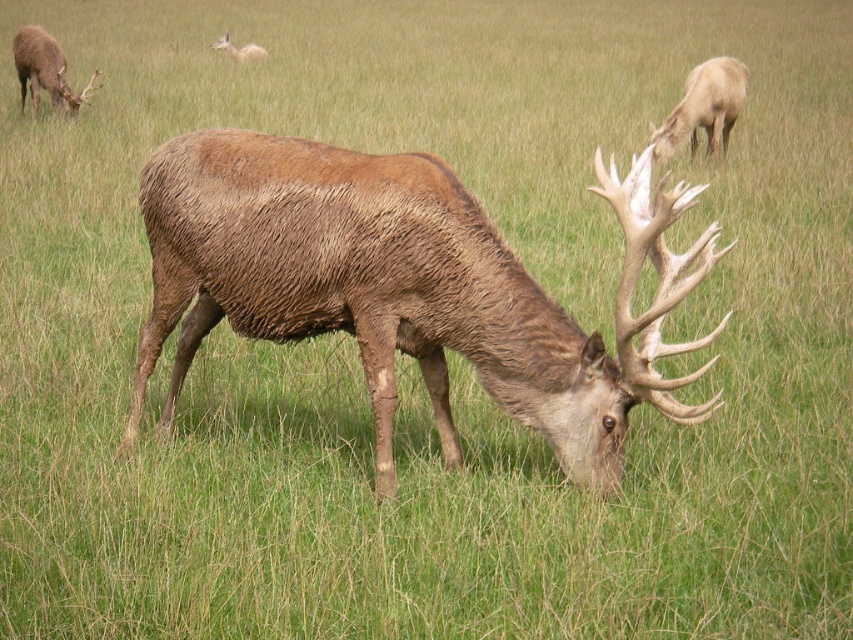
You are a wildlife photographer aiming to capture a photo of the brown furry deer at center and the brown velvet deer at upper left. Since you want both deer to be in focus, which deer should you focus on first to ensure proper depth of field?

The brown velvet deer at upper left is further away than the brown furry deer at center. To ensure both are in focus, you should focus on the brown velvet deer at upper left first.